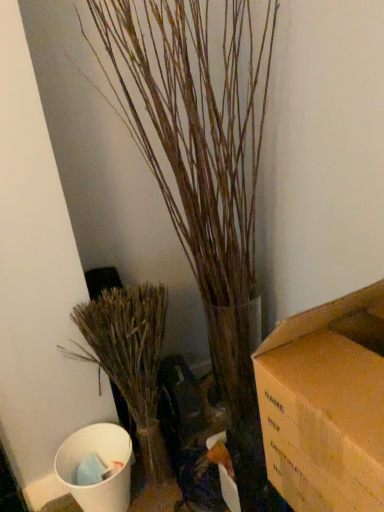
The height and width of the screenshot is (512, 384). I want to click on brown textured plant at center, the 2th houseplant positioned from the bottom, so click(205, 184).

What do you see at coordinates (205, 184) in the screenshot? The width and height of the screenshot is (384, 512). I see `brown textured plant at center, placed as the first houseplant when sorted from top to bottom` at bounding box center [205, 184].

The height and width of the screenshot is (512, 384). What do you see at coordinates (130, 358) in the screenshot? I see `bare wood branches at left, which is the first houseplant in bottom-to-top order` at bounding box center [130, 358].

Find the location of a particular element. The height and width of the screenshot is (512, 384). bare wood branches at left, which is the first houseplant in bottom-to-top order is located at coordinates 130,358.

I want to click on brown textured plant at center, placed as the first houseplant when sorted from top to bottom, so click(x=205, y=184).

Does brown textured plant at center, the 2th houseplant positioned from the bottom, appear on the right side of bare wood branches at left, which appears as the 2th houseplant when viewed from the top?

Yes, brown textured plant at center, the 2th houseplant positioned from the bottom, is to the right of bare wood branches at left, which appears as the 2th houseplant when viewed from the top.

Between brown textured plant at center, the 2th houseplant positioned from the bottom, and bare wood branches at left, which is the first houseplant in bottom-to-top order, which one is positioned in front?

brown textured plant at center, the 2th houseplant positioned from the bottom, is in front.

Which is behind, point (122, 42) or point (76, 311)?

Point (76, 311)

From the image's perspective, which one is positioned higher, brown textured plant at center, placed as the first houseplant when sorted from top to bottom, or bare wood branches at left, which is the first houseplant in bottom-to-top order?

From the image's view, brown textured plant at center, placed as the first houseplant when sorted from top to bottom, is above.

From a real-world perspective, is brown textured plant at center, placed as the first houseplant when sorted from top to bottom, above or below bare wood branches at left, which is the first houseplant in bottom-to-top order?

From a real-world perspective, brown textured plant at center, placed as the first houseplant when sorted from top to bottom, is physically above bare wood branches at left, which is the first houseplant in bottom-to-top order.

Which object is thinner, brown textured plant at center, placed as the first houseplant when sorted from top to bottom, or bare wood branches at left, which is the first houseplant in bottom-to-top order?

bare wood branches at left, which is the first houseplant in bottom-to-top order.

Is brown textured plant at center, placed as the first houseplant when sorted from top to bottom, taller or shorter than bare wood branches at left, which appears as the 2th houseplant when viewed from the top?

Considering their sizes, brown textured plant at center, placed as the first houseplant when sorted from top to bottom, has more height than bare wood branches at left, which appears as the 2th houseplant when viewed from the top.

Consider the image. Does brown textured plant at center, the 2th houseplant positioned from the bottom, have a smaller size compared to bare wood branches at left, which appears as the 2th houseplant when viewed from the top?

No, brown textured plant at center, the 2th houseplant positioned from the bottom, is not smaller than bare wood branches at left, which appears as the 2th houseplant when viewed from the top.

Is brown textured plant at center, placed as the first houseplant when sorted from top to bottom, positioned beyond the bounds of bare wood branches at left, which appears as the 2th houseplant when viewed from the top?

brown textured plant at center, placed as the first houseplant when sorted from top to bottom, lies outside bare wood branches at left, which appears as the 2th houseplant when viewed from the top,'s area.

Is brown textured plant at center, the 2th houseplant positioned from the bottom, in contact with bare wood branches at left, which appears as the 2th houseplant when viewed from the top?

No, brown textured plant at center, the 2th houseplant positioned from the bottom, is not beside bare wood branches at left, which appears as the 2th houseplant when viewed from the top.

Consider the image. Is brown textured plant at center, placed as the first houseplant when sorted from top to bottom, looking in the opposite direction of bare wood branches at left, which appears as the 2th houseplant when viewed from the top?

brown textured plant at center, placed as the first houseplant when sorted from top to bottom, does not have its back to bare wood branches at left, which appears as the 2th houseplant when viewed from the top.

How many degrees apart are the facing directions of brown textured plant at center, placed as the first houseplant when sorted from top to bottom, and bare wood branches at left, which is the first houseplant in bottom-to-top order?

5.94e-05 degrees.

This screenshot has height=512, width=384. What are the coordinates of `houseplant located above the bare wood branches at left, which is the first houseplant in bottom-to-top order (from the image's perspective)` in the screenshot? It's located at (205, 184).

Considering the positions of objects bare wood branches at left, which is the first houseplant in bottom-to-top order, and brown textured plant at center, the 2th houseplant positioned from the bottom, in the image provided, who is more to the right, bare wood branches at left, which is the first houseplant in bottom-to-top order, or brown textured plant at center, the 2th houseplant positioned from the bottom,?

From the viewer's perspective, brown textured plant at center, the 2th houseplant positioned from the bottom, appears more on the right side.

Is bare wood branches at left, which is the first houseplant in bottom-to-top order, positioned behind brown textured plant at center, placed as the first houseplant when sorted from top to bottom?

Yes, bare wood branches at left, which is the first houseplant in bottom-to-top order, is further from the viewer.

Between point (90, 307) and point (154, 55), which one is positioned behind?

The point (90, 307) is behind.

From the image's perspective, is bare wood branches at left, which appears as the 2th houseplant when viewed from the top, under brown textured plant at center, placed as the first houseplant when sorted from top to bottom?

Yes, from the image's perspective, bare wood branches at left, which appears as the 2th houseplant when viewed from the top, is beneath brown textured plant at center, placed as the first houseplant when sorted from top to bottom.

From a real-world perspective, which is physically below, bare wood branches at left, which is the first houseplant in bottom-to-top order, or brown textured plant at center, the 2th houseplant positioned from the bottom?

From a 3D spatial view, bare wood branches at left, which is the first houseplant in bottom-to-top order, is below.

Which object is wider, bare wood branches at left, which appears as the 2th houseplant when viewed from the top, or brown textured plant at center, the 2th houseplant positioned from the bottom?

With larger width is brown textured plant at center, the 2th houseplant positioned from the bottom.

Considering the relative sizes of bare wood branches at left, which is the first houseplant in bottom-to-top order, and brown textured plant at center, the 2th houseplant positioned from the bottom, in the image provided, is bare wood branches at left, which is the first houseplant in bottom-to-top order, taller than brown textured plant at center, the 2th houseplant positioned from the bottom,?

In fact, bare wood branches at left, which is the first houseplant in bottom-to-top order, may be shorter than brown textured plant at center, the 2th houseplant positioned from the bottom.

Consider the image. Which of these two, bare wood branches at left, which appears as the 2th houseplant when viewed from the top, or brown textured plant at center, the 2th houseplant positioned from the bottom, is smaller?

bare wood branches at left, which appears as the 2th houseplant when viewed from the top, is smaller.

Would you say bare wood branches at left, which appears as the 2th houseplant when viewed from the top, contains brown textured plant at center, the 2th houseplant positioned from the bottom?

No, brown textured plant at center, the 2th houseplant positioned from the bottom, is not a part of bare wood branches at left, which appears as the 2th houseplant when viewed from the top.

Is bare wood branches at left, which is the first houseplant in bottom-to-top order, next to brown textured plant at center, placed as the first houseplant when sorted from top to bottom?

They are not placed beside each other.

Is brown textured plant at center, placed as the first houseplant when sorted from top to bottom, at the back of bare wood branches at left, which appears as the 2th houseplant when viewed from the top?

No.

Consider the image. How far apart are bare wood branches at left, which appears as the 2th houseplant when viewed from the top, and brown textured plant at center, placed as the first houseplant when sorted from top to bottom?

bare wood branches at left, which appears as the 2th houseplant when viewed from the top, is 18.01 inches away from brown textured plant at center, placed as the first houseplant when sorted from top to bottom.

Image resolution: width=384 pixels, height=512 pixels. I want to click on houseplant on the left of brown textured plant at center, the 2th houseplant positioned from the bottom, so click(130, 358).

Locate an element on the screen. houseplant above the bare wood branches at left, which appears as the 2th houseplant when viewed from the top (from the image's perspective) is located at coordinates (205, 184).

Find the location of a particular element. The height and width of the screenshot is (512, 384). houseplant behind the brown textured plant at center, placed as the first houseplant when sorted from top to bottom is located at coordinates (130, 358).